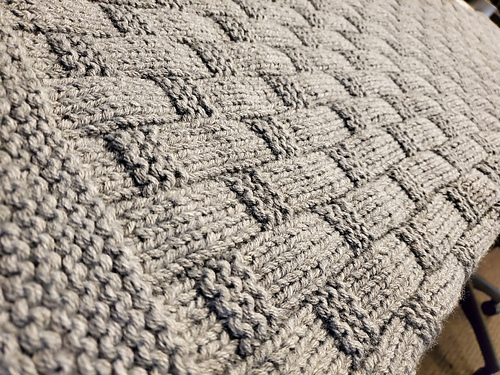
You are a GUI agent. You are given a task and a screenshot of the screen. Output one action in this format:
    pyautogui.click(x=<x>, y=<y>)
    Task: Click on the shadow of the chair
    This screenshot has width=500, height=375.
    Given the screenshot: What is the action you would take?
    pyautogui.click(x=458, y=334)